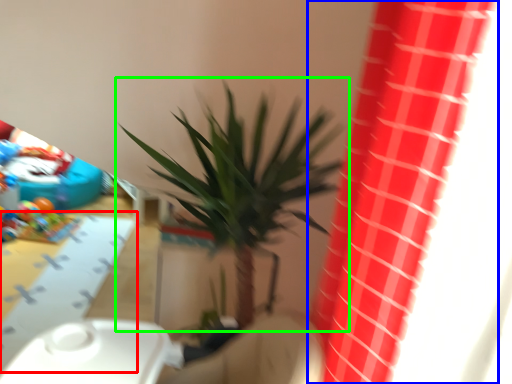
Question: Which object is the closest to the table (highlighted by a red box)? Choose among these: curtain (highlighted by a blue box) or houseplant (highlighted by a green box).

Choices:
 (A) curtain
 (B) houseplant

Answer: (B)